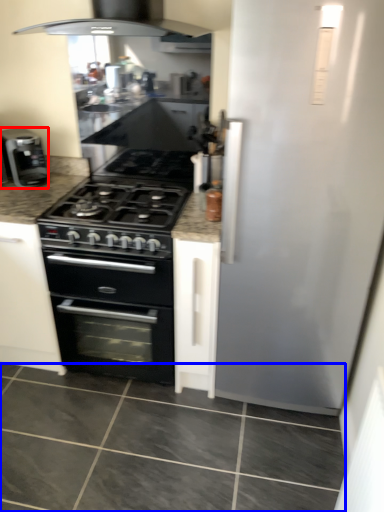
Question: Among these objects, which one is farthest to the camera, kitchen appliance (highlighted by a red box) or granite (highlighted by a blue box)?

Choices:
 (A) kitchen appliance
 (B) granite

Answer: (A)